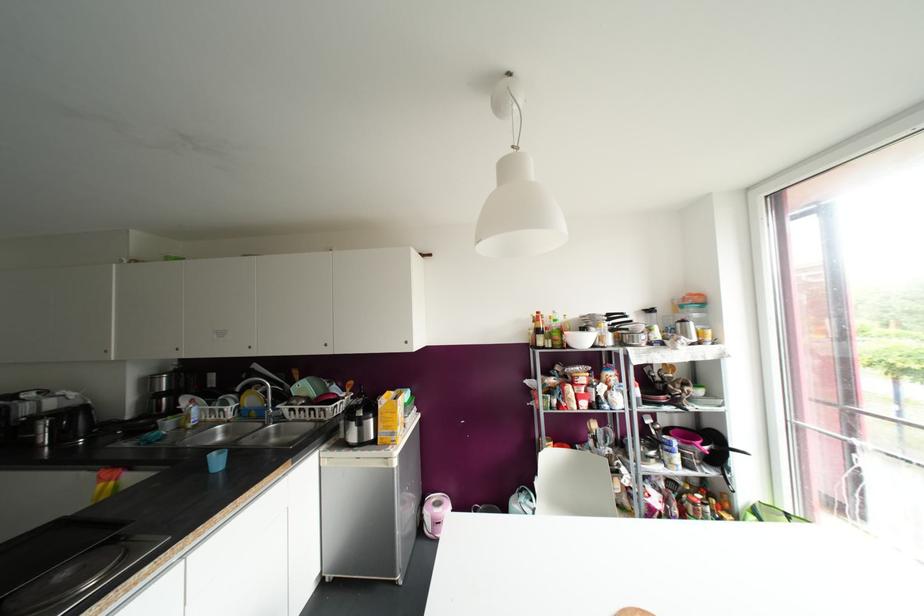
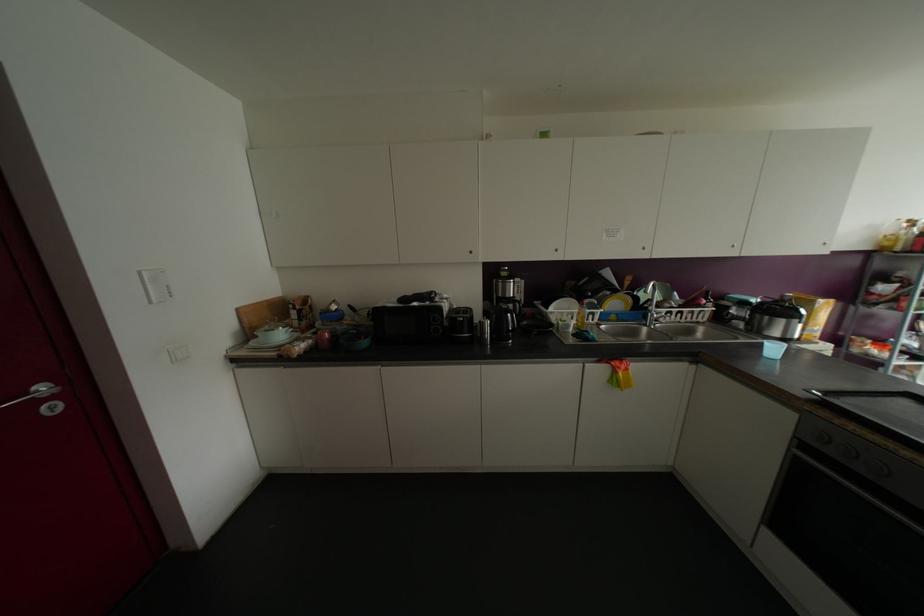
Where in the second image is the point corresponding to the point at 301,416 from the first image?

(677, 318)